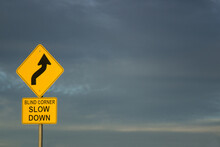
At what (x,y) coordinates should I click in order to perform the action: click on screws. Please return your answer as a coordinate pair (x, y). Looking at the image, I should click on (40, 50), (40, 91).